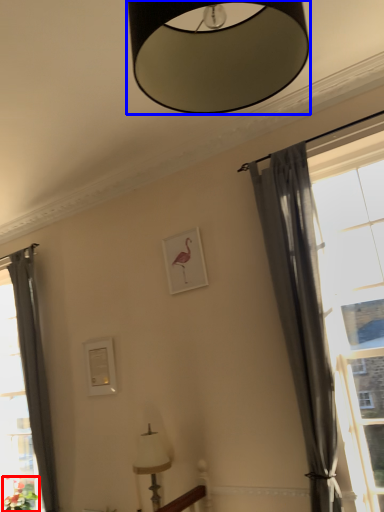
Question: Which object is further to the camera taking this photo, plant (highlighted by a red box) or lamp (highlighted by a blue box)?

Choices:
 (A) plant
 (B) lamp

Answer: (A)